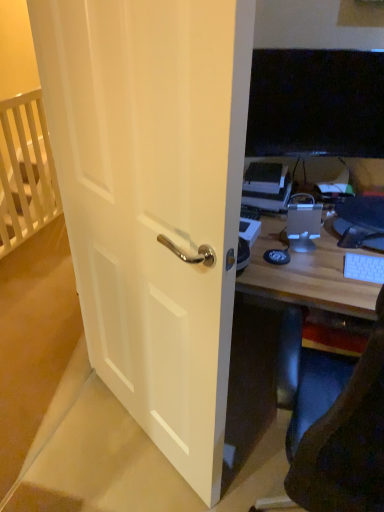
Question: Can you confirm if white wooden crib at upper left is wider than white plastic keyboard at right?

Choices:
 (A) no
 (B) yes

Answer: (A)

Question: Does white wooden crib at upper left have a larger size compared to white plastic keyboard at right?

Choices:
 (A) no
 (B) yes

Answer: (B)

Question: From a real-world perspective, is white wooden crib at upper left positioned under white plastic keyboard at right based on gravity?

Choices:
 (A) no
 (B) yes

Answer: (B)

Question: From the image's perspective, is white wooden crib at upper left above white plastic keyboard at right?

Choices:
 (A) yes
 (B) no

Answer: (A)

Question: Does white wooden crib at upper left have a greater height compared to white plastic keyboard at right?

Choices:
 (A) yes
 (B) no

Answer: (A)

Question: Considering the positions of point (170, 194) and point (294, 230), is point (170, 194) closer or farther from the camera than point (294, 230)?

Choices:
 (A) closer
 (B) farther

Answer: (A)

Question: Visually, is white matte door at center positioned to the left or to the right of satin silver desktop at center?

Choices:
 (A) left
 (B) right

Answer: (A)

Question: Based on their sizes in the image, would you say white matte door at center is bigger or smaller than satin silver desktop at center?

Choices:
 (A) big
 (B) small

Answer: (A)

Question: From the image's perspective, is white matte door at center located above or below satin silver desktop at center?

Choices:
 (A) below
 (B) above

Answer: (A)

Question: In terms of height, does white plastic keyboard at right look taller or shorter compared to white wooden crib at upper left?

Choices:
 (A) tall
 (B) short

Answer: (B)

Question: From the image's perspective, is white plastic keyboard at right positioned above or below white wooden crib at upper left?

Choices:
 (A) above
 (B) below

Answer: (B)

Question: Choose the correct answer: Is white plastic keyboard at right inside white wooden crib at upper left or outside it?

Choices:
 (A) inside
 (B) outside

Answer: (B)

Question: Is white plastic keyboard at right to the left or to the right of white wooden crib at upper left in the image?

Choices:
 (A) left
 (B) right

Answer: (B)

Question: From the image's perspective, relative to white wooden crib at upper left, is satin silver desktop at center above or below?

Choices:
 (A) above
 (B) below

Answer: (B)

Question: Considering the positions of satin silver desktop at center and white wooden crib at upper left in the image, is satin silver desktop at center bigger or smaller than white wooden crib at upper left?

Choices:
 (A) big
 (B) small

Answer: (B)